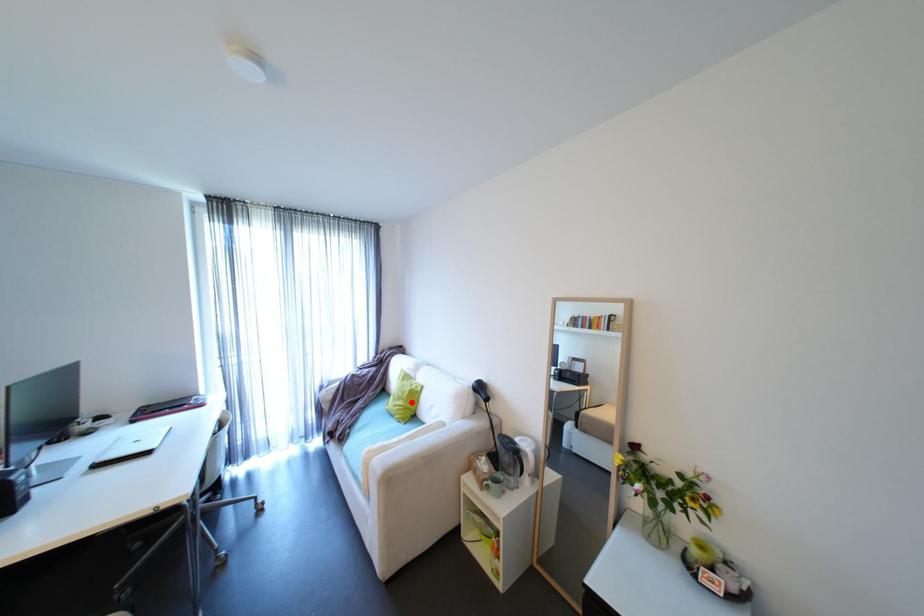
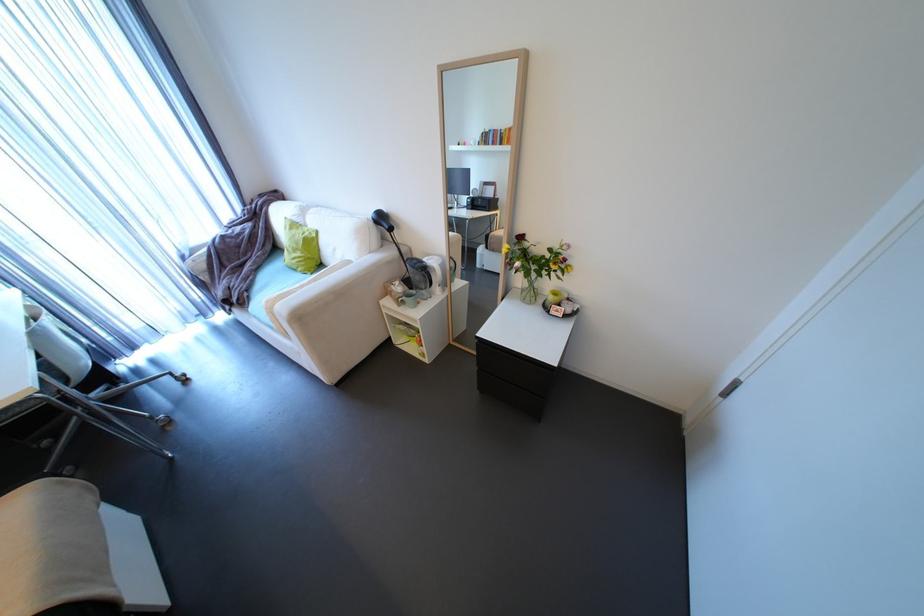
Find the pixel in the second image that matches the highlighted location in the first image.

(310, 253)